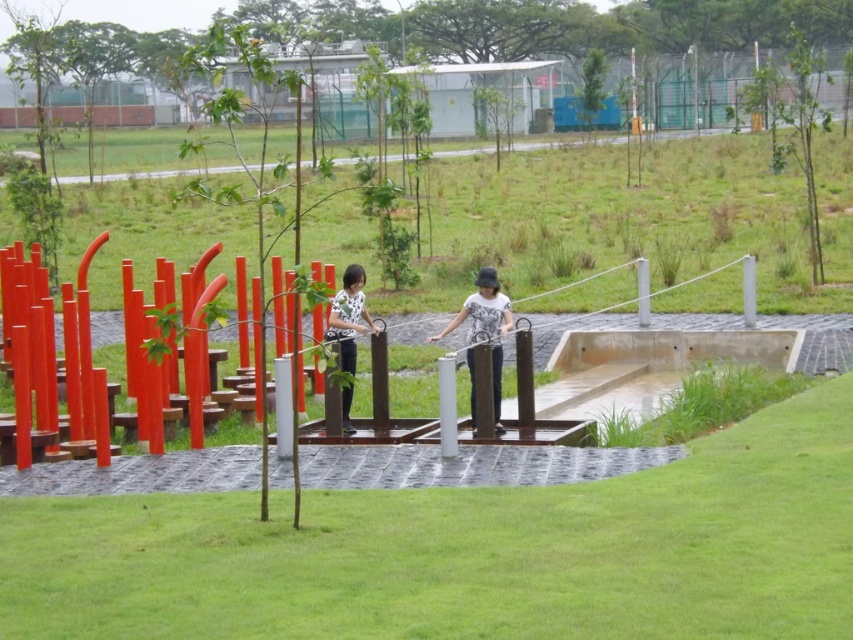
You are a photographer trying to capture both the white matte shirt at center and the white dotted shirt at center in a single frame. Given their widths, which person should you position closer to the camera to ensure both fit within the frame?

Since the white matte shirt at center is wider than the white dotted shirt at center, you should position the white dotted shirt at center closer to the camera to compensate for its narrower width and ensure both fit within the frame.

You are a photographer trying to capture a photo of both the white matte shirt at center and the white dotted shirt at center. Since you want both subjects to be fully visible in the frame, which person should you position closer to the camera to avoid being blocked by the other?

You should position the white dotted shirt at center closer to the camera because the white matte shirt at center is shorter than the white dotted shirt at center, so the taller person will block the shorter one if they are behind.

You are standing at the camera position and want to cross to the other side of the water feature. The metallic silver rope bridge at center is the only path. Can you safely walk across it if your maximum comfortable walking distance on such bridges is 10 meters?

The distance between the metallic silver rope bridge at center and the camera is 11.71 meters, which exceeds your maximum comfortable walking distance of 10 meters. Therefore, it might not be safe to walk across the metallic silver rope bridge at center.